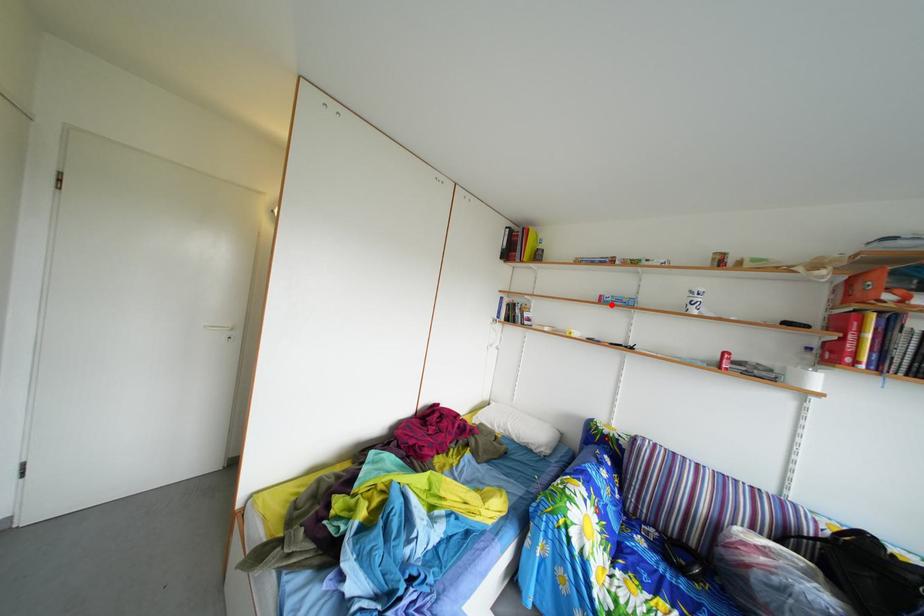
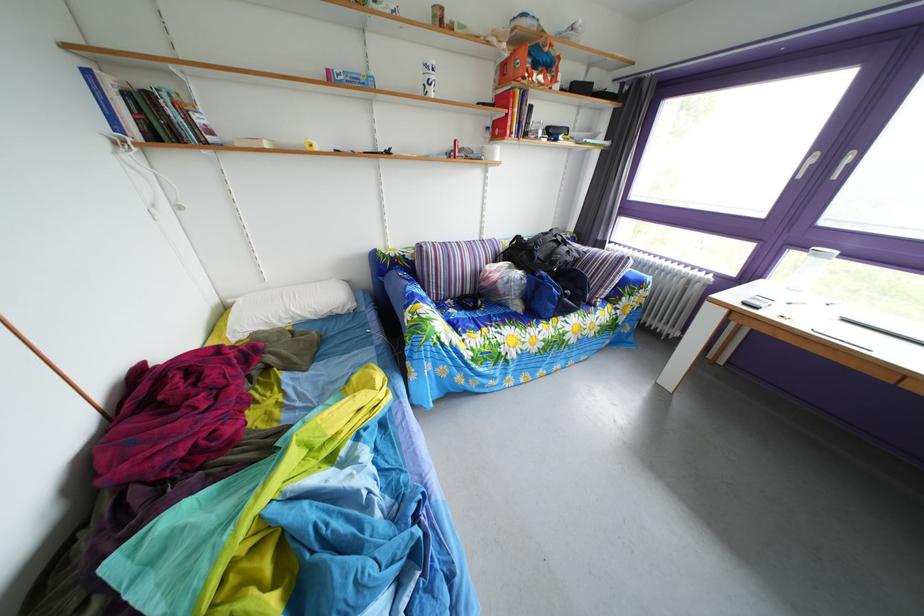
Where in the second image is the point corresponding to the highlighted location from the first image?

(339, 79)